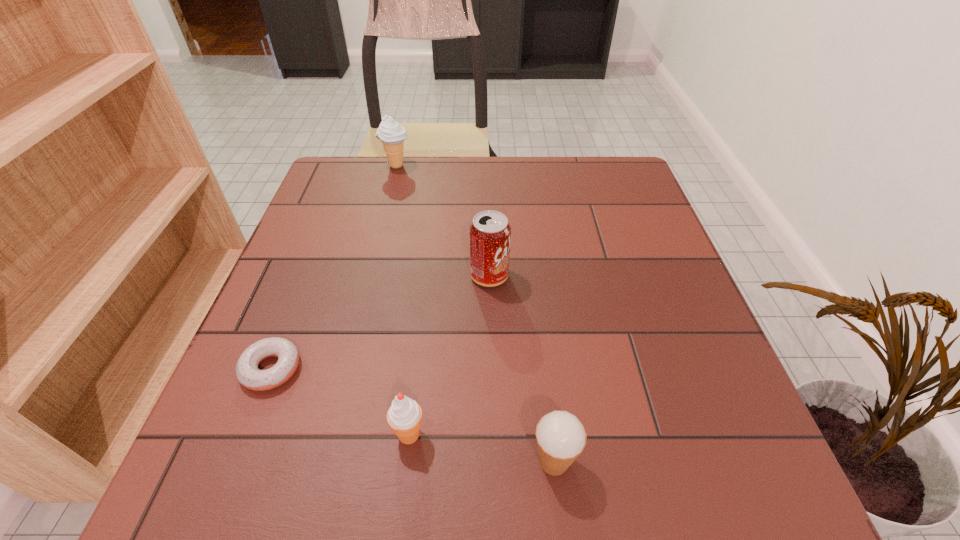
I want to click on vacant area that satisfies the following two spatial constraints: 1. on the back side of the second object from right to left; 2. on the right side of the leftmost object, so click(x=308, y=276).